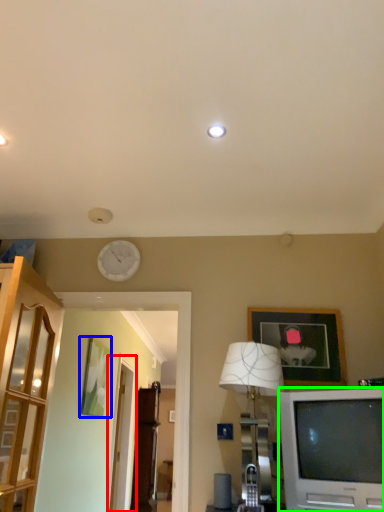
Question: Considering the real-world distances, which object is closest to glass door (highlighted by a red box)? picture frame (highlighted by a blue box) or television (highlighted by a green box).

Choices:
 (A) picture frame
 (B) television

Answer: (A)